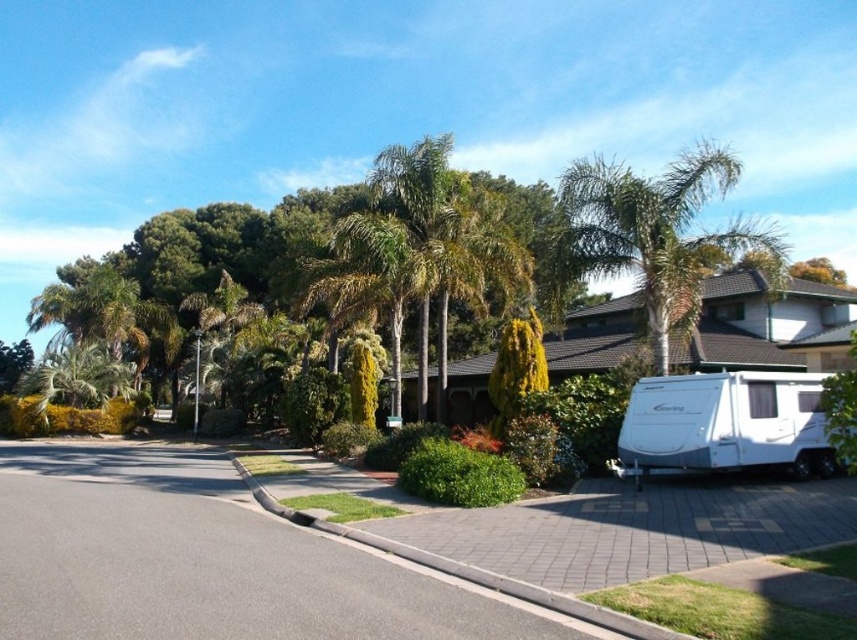
Based on the photo, who is lower down, green leafy palm tree at center or white glossy caravan at lower right?

white glossy caravan at lower right

Does green leafy palm tree at center have a smaller size compared to white glossy caravan at lower right?

Incorrect, green leafy palm tree at center is not smaller in size than white glossy caravan at lower right.

This screenshot has width=857, height=640. In order to click on green leafy palm tree at center in this screenshot , I will do `click(423, 250)`.

Does green leafy palm tree at upper center lie in front of white glossy caravan at lower right?

No, it is not.

Does green leafy palm tree at upper center have a smaller size compared to white glossy caravan at lower right?

No, green leafy palm tree at upper center is not smaller than white glossy caravan at lower right.

Looking at this image, who is more distant from viewer, (634, 182) or (682, 412)?

Positioned behind is point (634, 182).

You are a GUI agent. You are given a task and a screenshot of the screen. Output one action in this format:
    pyautogui.click(x=<x>, y=<y>)
    Task: Click on the green leafy palm tree at upper center
    The width and height of the screenshot is (857, 640).
    Given the screenshot: What is the action you would take?
    pyautogui.click(x=656, y=232)

Does green leafy palm tree at center come in front of green leafy palm tree at upper center?

That is False.

Can you confirm if green leafy palm tree at center is positioned to the left of green leafy palm tree at upper center?

Correct, you'll find green leafy palm tree at center to the left of green leafy palm tree at upper center.

Does point (393, 154) lie in front of point (586, 256)?

No.

Find the location of `green leafy palm tree at center`. green leafy palm tree at center is located at coordinates (423, 250).